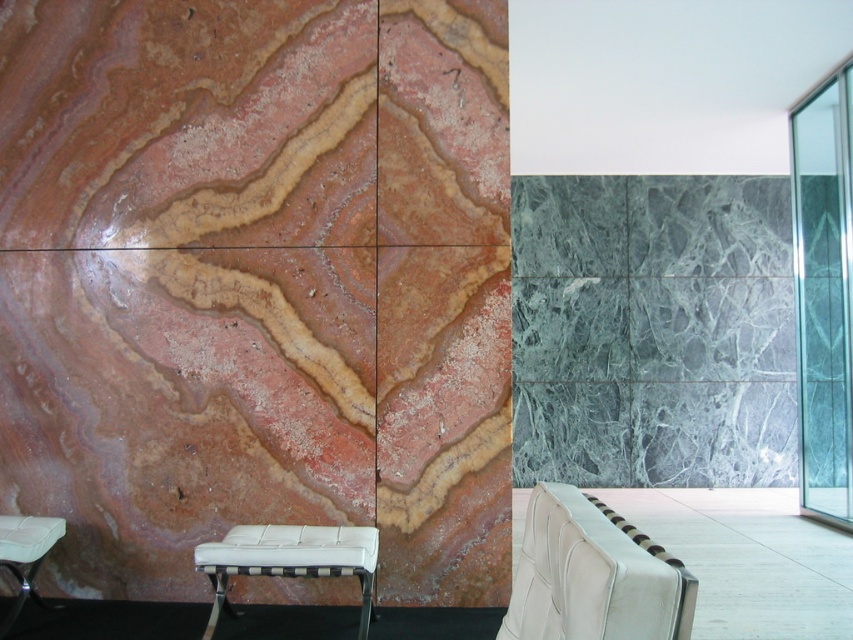
Question: Does white leather chair at center appear over white leather stool at lower left?

Choices:
 (A) no
 (B) yes

Answer: (B)

Question: Is white leather bench at lower center smaller than white leather stool at lower left?

Choices:
 (A) yes
 (B) no

Answer: (B)

Question: Which object is farther from the camera taking this photo?

Choices:
 (A) transparent glass door at right
 (B) white leather bench at lower center
 (C) marble textured wall at left
 (D) white leather chair at center

Answer: (A)

Question: Is marble textured wall at left closer to camera compared to white leather stool at lower left?

Choices:
 (A) yes
 (B) no

Answer: (B)

Question: Which object is positioned closest to the white leather bench at lower center?

Choices:
 (A) white leather stool at lower left
 (B) transparent glass door at right
 (C) white leather chair at center

Answer: (A)

Question: Which object appears farthest from the camera in this image?

Choices:
 (A) white leather chair at center
 (B) white leather stool at lower left
 (C) transparent glass door at right

Answer: (C)